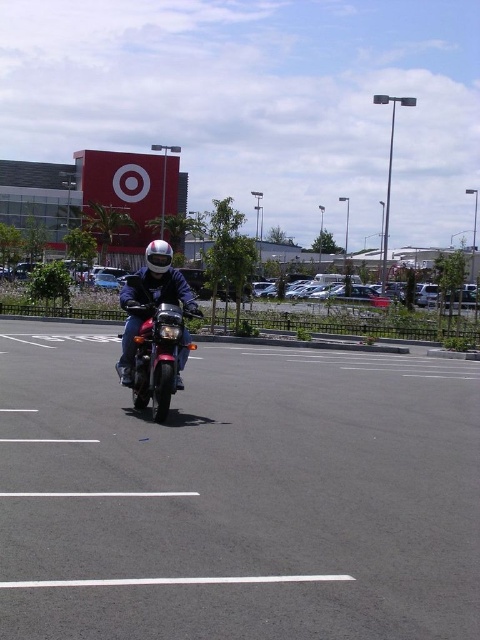
Based on the photo, can you confirm if black asphalt parking lot at center is smaller than shiny chrome motorbike at center?

No, black asphalt parking lot at center is not smaller than shiny chrome motorbike at center.

Which is behind, point (444, 550) or point (173, 388)?

Positioned behind is point (173, 388).

Which is in front, point (176, 637) or point (149, 355)?

Point (176, 637) is in front.

The height and width of the screenshot is (640, 480). In order to click on black asphalt parking lot at center in this screenshot , I will do pos(237,493).

Does shiny chrome motorbike at center appear over shiny silver helmet at center?

No, shiny chrome motorbike at center is not above shiny silver helmet at center.

Does shiny chrome motorbike at center have a smaller size compared to shiny silver helmet at center?

Yes.

Where is `shiny chrome motorbike at center`? shiny chrome motorbike at center is located at coordinates (158, 355).

From the picture: Which is below, black asphalt parking lot at center or shiny silver helmet at center?

black asphalt parking lot at center is below.

Which is in front, point (350, 508) or point (144, 312)?

Positioned in front is point (350, 508).

Does point (396, 524) come farther from viewer compared to point (179, 289)?

No, it is in front of (179, 289).

Find the location of `black asphalt parking lot at center`. black asphalt parking lot at center is located at coordinates (237, 493).